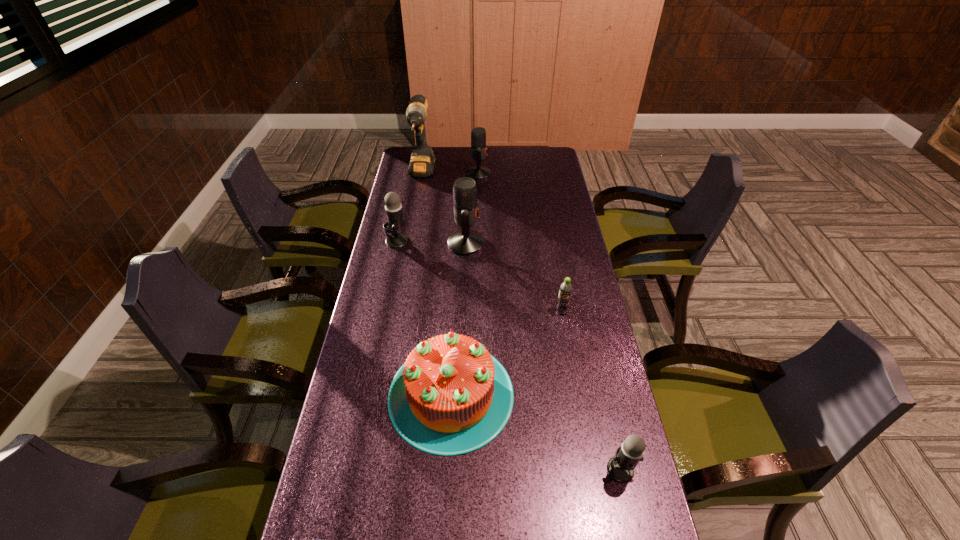
This screenshot has width=960, height=540. What are the coordinates of `microphone that is at the far edge` in the screenshot? It's located at (478, 134).

Find the location of a particular element. This screenshot has height=540, width=960. drill positioned at the left edge is located at coordinates (422, 161).

Image resolution: width=960 pixels, height=540 pixels. In order to click on microphone at the left edge in this screenshot , I will do `click(395, 221)`.

The width and height of the screenshot is (960, 540). I want to click on cake present at the left edge, so click(451, 397).

Identify the location of microphone that is at the right edge. (620, 467).

This screenshot has width=960, height=540. I want to click on soda situated at the right edge, so click(x=564, y=298).

The width and height of the screenshot is (960, 540). Identify the location of object present at the far left corner. (422, 161).

In the image, there is a desktop. What are the coordinates of `vacant space at the far edge` in the screenshot? It's located at (488, 152).

This screenshot has width=960, height=540. Identify the location of free space at the left edge of the desktop. (381, 238).

I want to click on vacant space at the right edge of the desktop, so click(x=563, y=267).